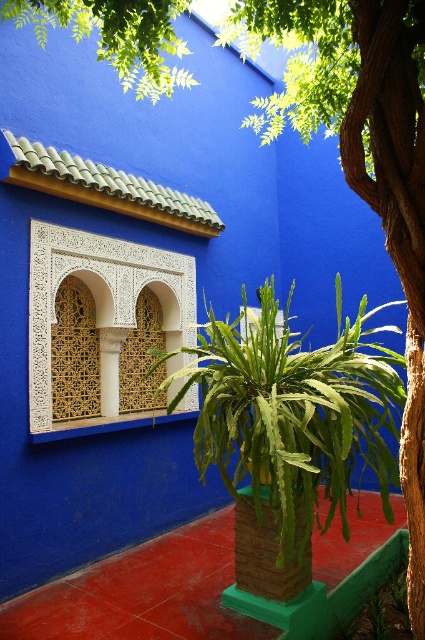
You are an interior designer planning to add a new plant to the courtyard. You have a green leafy fern at center and a white carved wood at center in the scene. Which object is positioned lower in the courtyard?

The green leafy fern at center is below white carved wood at center, so the green leafy fern at center is positioned lower in the courtyard.

You are standing in the courtyard and want to place a small decorative pot between the green leafy fern at center and the brick textured pillar at center. Based on their positions, which side of the pillar should you place the pot to keep it aligned with the existing arrangement?

The green leafy fern at center is positioned on the right side of brick textured pillar at center, so placing the pot to the right of the brick textured pillar at center would align it with the existing arrangement.